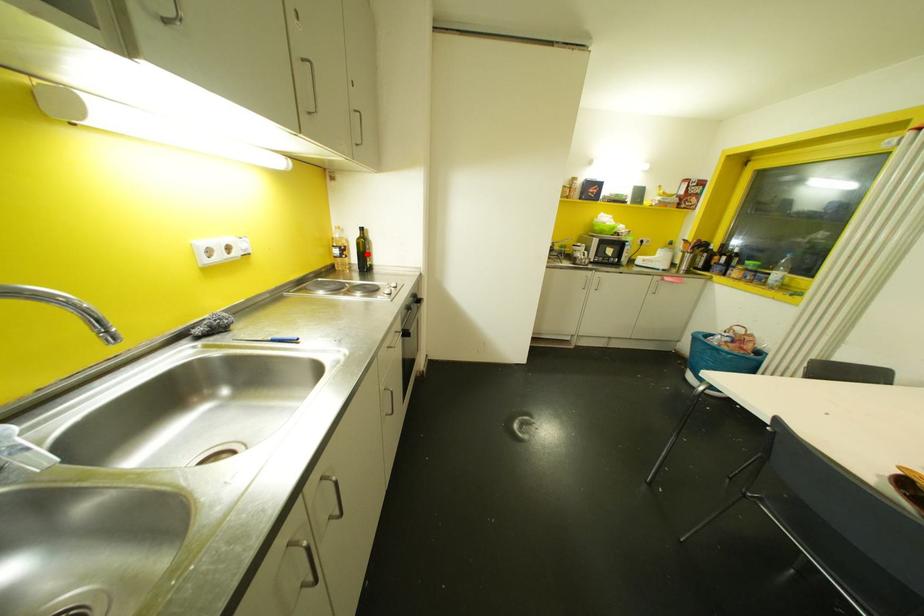
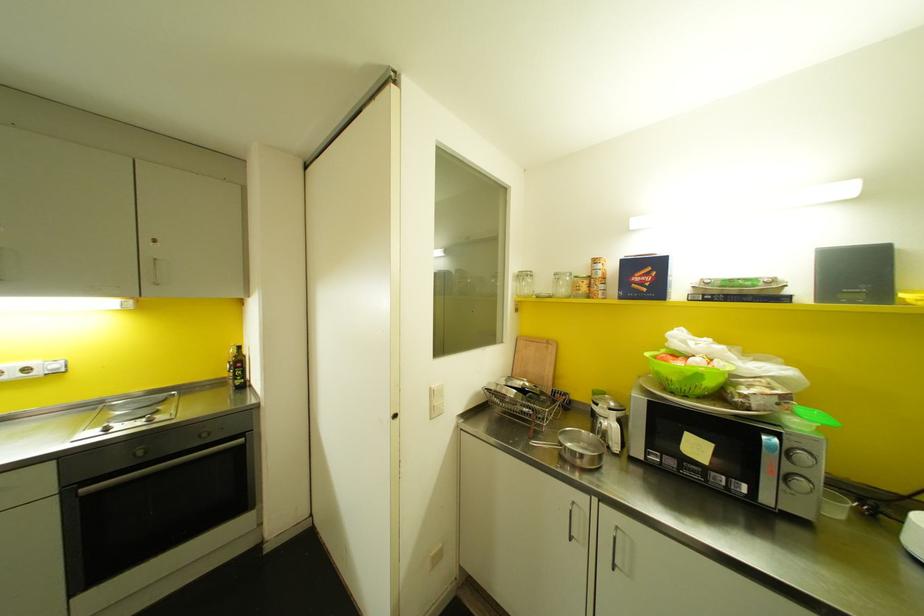
Question: I am providing you with two images of the same scene from different viewpoints. A red point is shown in image1. For the corresponding object point in image2, is it positioned nearer or farther from the camera?

Choices:
 (A) Nearer
 (B) Farther

Answer: (B)